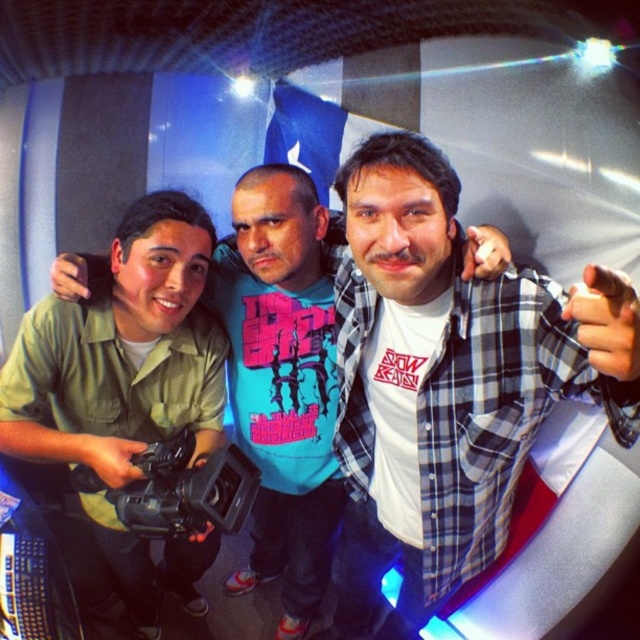
Does plaid shirt at center have a lesser height compared to black plastic camera at center?

In fact, plaid shirt at center may be taller than black plastic camera at center.

Who is higher up, plaid shirt at center or black plastic camera at center?

black plastic camera at center is above.

Find the location of `plaid shirt at center`. plaid shirt at center is located at coordinates (448, 384).

Locate an element on the screen. Image resolution: width=640 pixels, height=640 pixels. plaid shirt at center is located at coordinates (448, 384).

Is point (413, 243) closer to viewer compared to point (67, 264)?

Yes.

Image resolution: width=640 pixels, height=640 pixels. I want to click on plaid shirt at center, so click(x=448, y=384).

Locate an element on the screen. The height and width of the screenshot is (640, 640). plaid shirt at center is located at coordinates (448, 384).

Who is positioned more to the left, green matte shirt at left or black plastic camera at center?

Positioned to the left is black plastic camera at center.

Between green matte shirt at left and black plastic camera at center, which one is positioned lower?

black plastic camera at center

This screenshot has width=640, height=640. Describe the element at coordinates (278, 227) in the screenshot. I see `green matte shirt at left` at that location.

This screenshot has width=640, height=640. I want to click on green matte shirt at left, so click(278, 227).